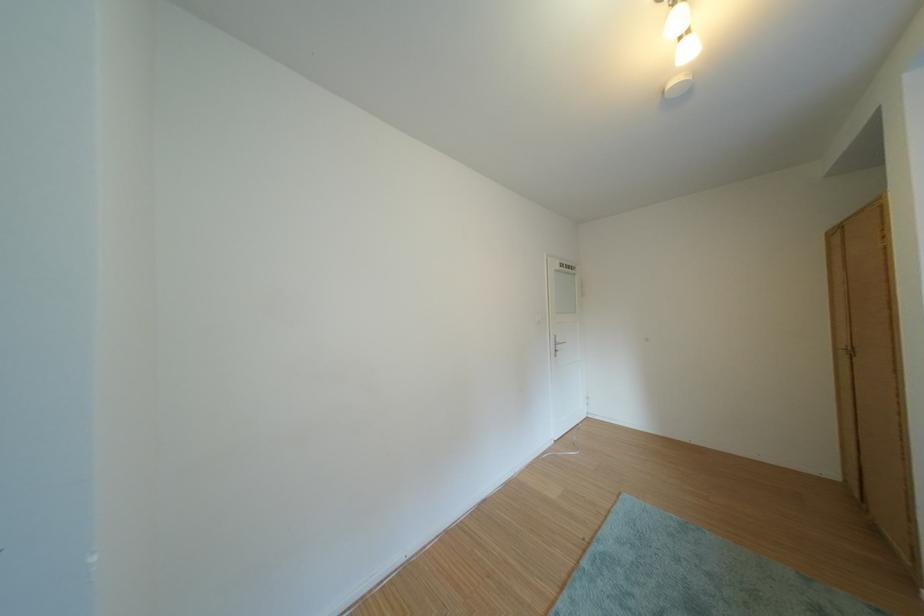
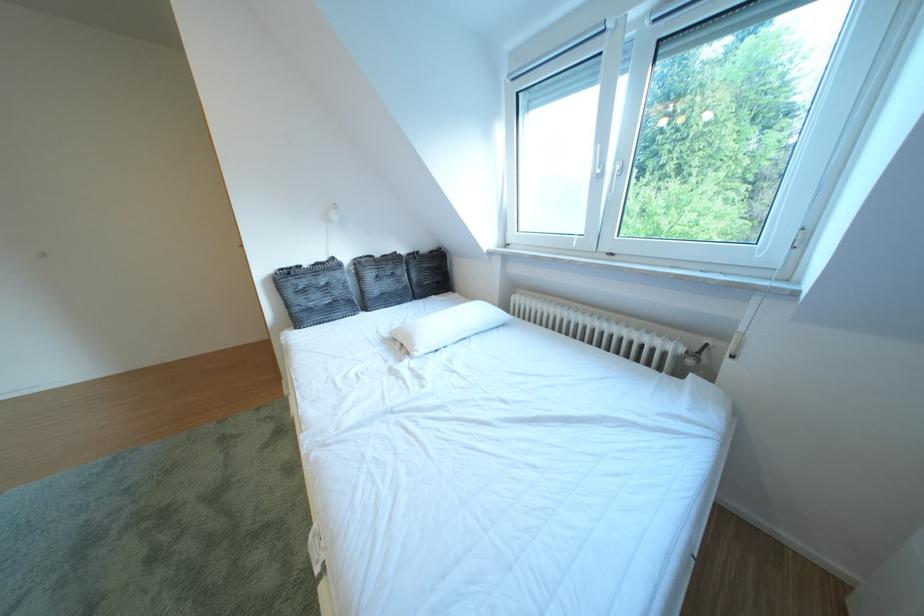
The images are taken continuously from a first-person perspective. In which direction is your viewpoint rotating?

The camera rotated toward right-down.